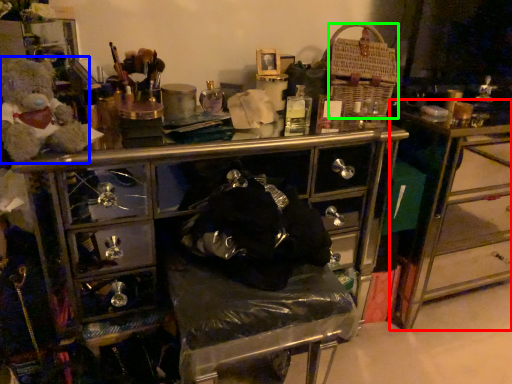
Question: Which object is positioned farthest from table (highlighted by a red box)? Select from teddy (highlighted by a blue box) and crate (highlighted by a green box).

Choices:
 (A) teddy
 (B) crate

Answer: (A)